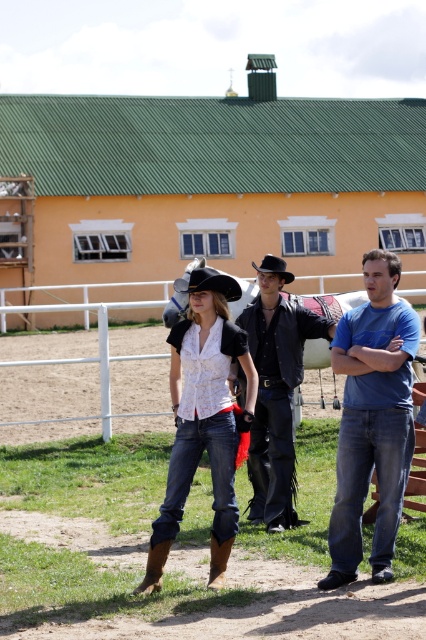
Question: Estimate the real-world distances between objects in this image. Which object is closer to the brown suede cowboy boot at lower center?

Choices:
 (A) blue cotton t-shirt at center
 (B) black felt cowboy hat at center
 (C) black leather cowboy hat at center
 (D) white glossy horse at center

Answer: (A)

Question: Is matte black cowboy hat at center below brown leather cowboy boot at lower center?

Choices:
 (A) no
 (B) yes

Answer: (A)

Question: Is leather jacket at center below brown leather cowboy boot at lower center?

Choices:
 (A) yes
 (B) no

Answer: (B)

Question: Which object is farther from the camera taking this photo?

Choices:
 (A) black felt cowboy hat at center
 (B) black leather cowboy hat at center

Answer: (B)

Question: Which object appears farthest from the camera in this image?

Choices:
 (A) black felt cowboy hat at center
 (B) white glossy horse at center
 (C) denim jeans at center

Answer: (B)

Question: Is matte black cowboy hat at center wider than black felt cowboy hat at center?

Choices:
 (A) yes
 (B) no

Answer: (B)